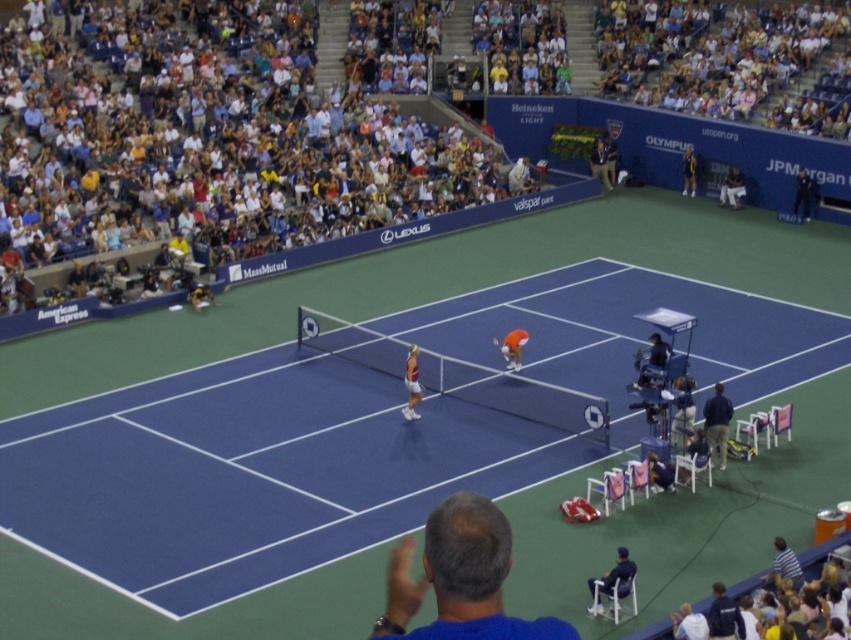
You are a tennis ball that just got hit by the orange fabric tennis player at center. Where should you go to stay on the court?

The orange fabric tennis player at center is located at point [512,348], so the ball should move towards the opponent side of the court to stay within the boundaries.

You are a photographer standing at the camera position. You want to capture a closeup shot of the white cotton crowd at upper left. Given that your camera has a maximum zoom range of 25 meters, will you be able to focus on them?

The white cotton crowd at upper left is 26.49 meters away from camera, which exceeds the maximum zoom range of 25 meters. Therefore, you cannot focus on them with the current camera settings.

You are a tennis ball that just left the racket of the orange player. Your current position is at point (292, 634). You need to reach the point (740, 176) to land in the opponent player area. Will you pass in front of the red player?

Yes, the tennis ball at point (292, 634) is in front of point (740, 176), so it will pass in front of the red player.